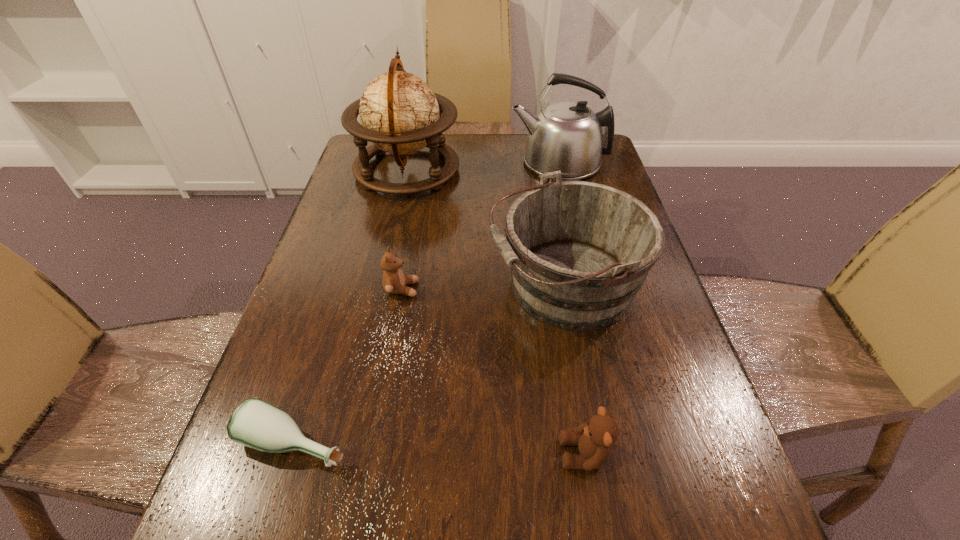
You are a GUI agent. You are given a task and a screenshot of the screen. Output one action in this format:
    pyautogui.click(x=<x>, y=<y>)
    Task: Click on the kettle present at the right edge
    This screenshot has height=540, width=960.
    Given the screenshot: What is the action you would take?
    pyautogui.click(x=566, y=136)

Find the location of a particular element. Image resolution: width=960 pixels, height=540 pixels. wine bucket at the right edge is located at coordinates (579, 252).

At what (x,y) coordinates should I click in order to perform the action: click on object situated at the far left corner. Please return your answer as a coordinate pair (x, y). This screenshot has height=540, width=960. Looking at the image, I should click on click(x=399, y=113).

The width and height of the screenshot is (960, 540). Identify the location of object that is at the far right corner. (566, 136).

Where is `vacant space at the far edge`? vacant space at the far edge is located at coordinates (516, 159).

The width and height of the screenshot is (960, 540). Find the location of `blank area at the left edge`. blank area at the left edge is located at coordinates click(x=382, y=213).

I want to click on free location at the right edge, so click(x=660, y=321).

The image size is (960, 540). In the image, there is a desktop. Find the location of `vacant space at the far right corner`. vacant space at the far right corner is located at coordinates (612, 173).

Locate an element on the screen. The height and width of the screenshot is (540, 960). vacant area that lies between the right teddy bear and the bottle is located at coordinates (440, 448).

You are a GUI agent. You are given a task and a screenshot of the screen. Output one action in this format:
    pyautogui.click(x=<x>, y=<y>)
    Task: Click on the free space between the wine bucket and the right teddy bear
    
    Given the screenshot: What is the action you would take?
    pyautogui.click(x=574, y=370)